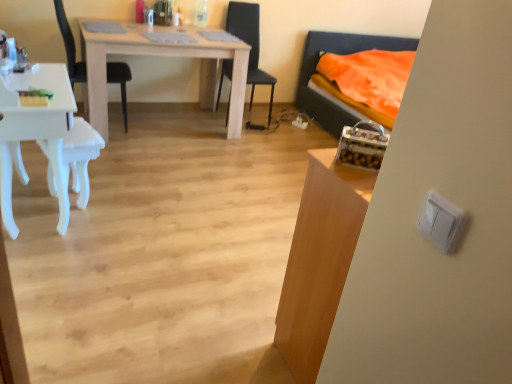
Image resolution: width=512 pixels, height=384 pixels. Find the location of `free space that is in between white glossy desk at left and white glossy switch at right, the second table from the back`. free space that is in between white glossy desk at left and white glossy switch at right, the second table from the back is located at coordinates (160, 273).